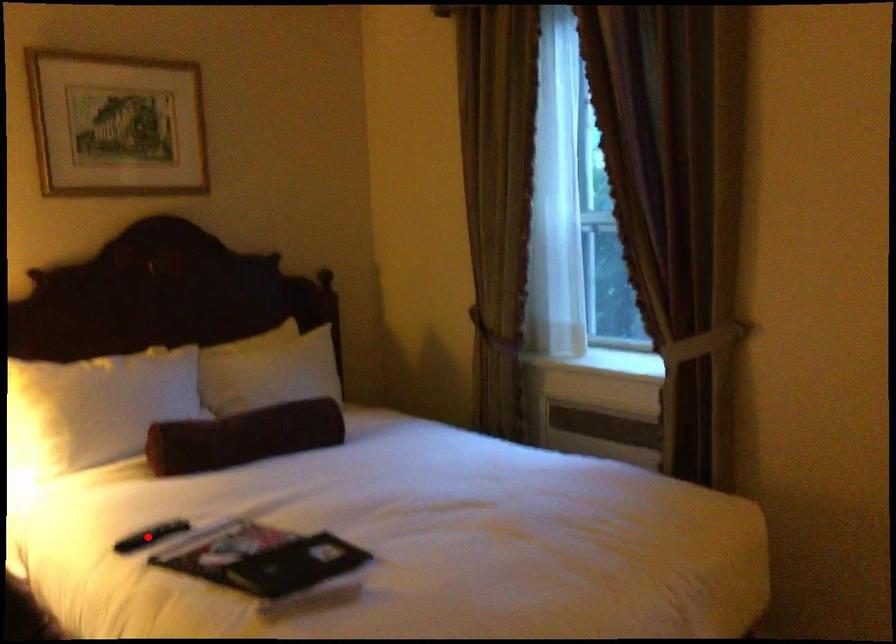
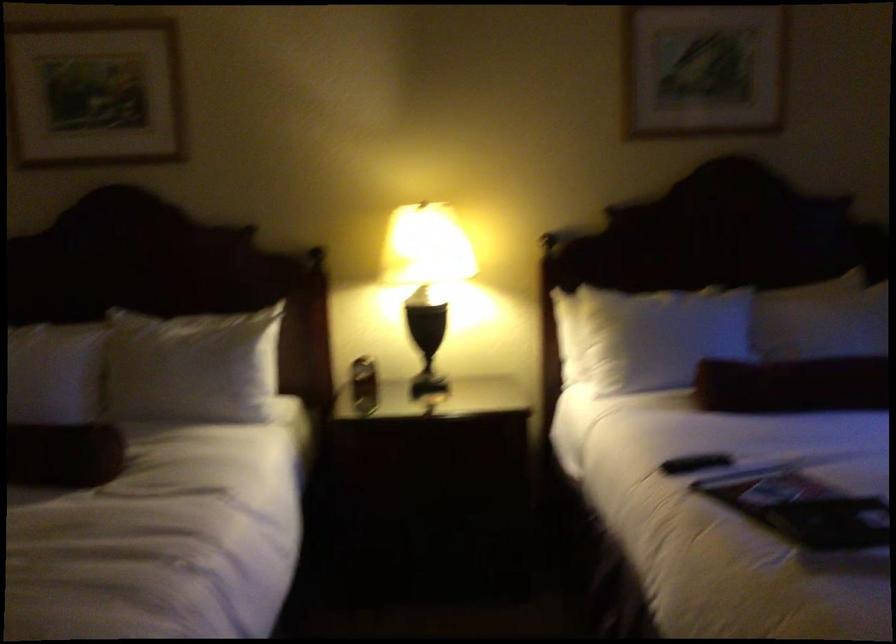
Where in the second image is the point corresponding to the highlighted location from the first image?

(695, 462)